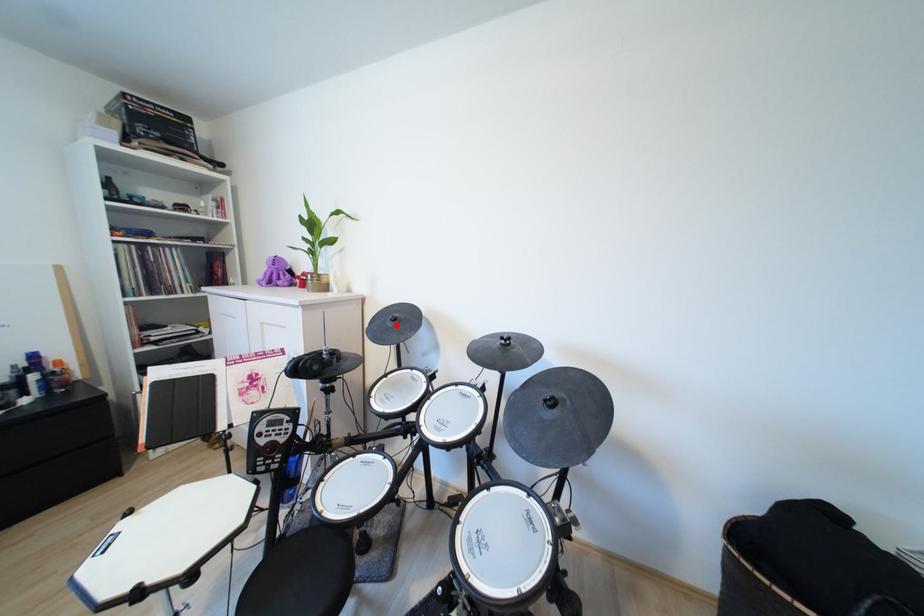
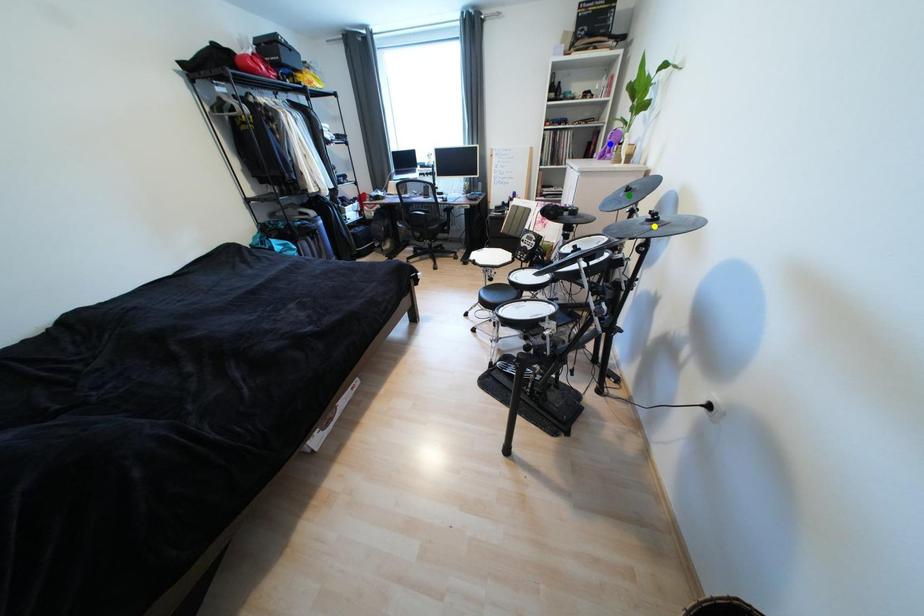
Question: I am providing you with two images of the same scene from different viewpoints. A red point is marked on the first image. You are given multiple points on the second image. Which point in image 2 is actually the same real-world point as the red point in image 1?

Choices:
 (A) yellow point
 (B) green point
 (C) blue point

Answer: (B)